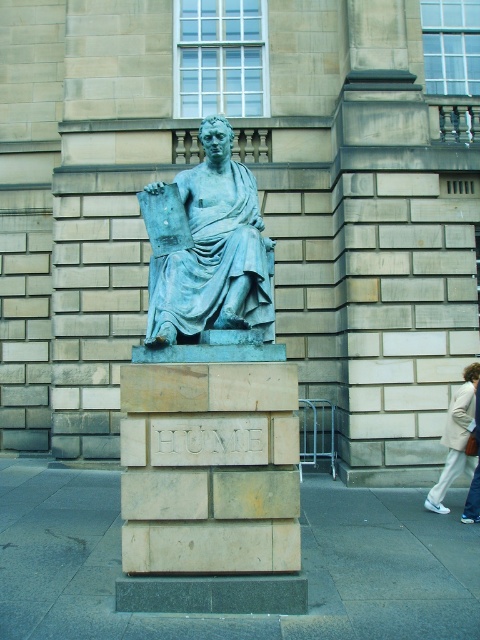
You are standing in front of the statue of HUME. There are two points marked on the statue. The first point is at coordinate point (222, 276) and the second is at point (446, 513). Which point is closer to you?

Point (222, 276) is closer to the viewer than point (446, 513).

You are a photographer trying to capture both the green patina statue at center and the light beige pants at lower right in a single frame. Given their sizes, which object should you focus on to ensure both fit in the frame without cropping?

The green patina statue at center is bigger than light beige pants at lower right. To ensure both fit in the frame without cropping, focus on the larger object, the green patina statue at center, and adjust the camera angle to include the smaller light beige pants at lower right.